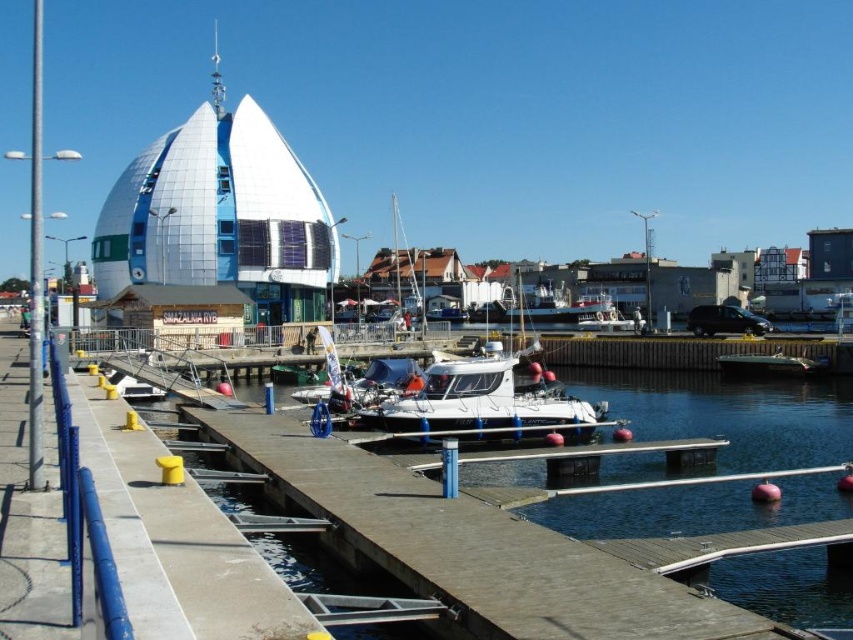
Question: Among these objects, which one is nearest to the camera?

Choices:
 (A) white glossy boat at lower right
 (B) white glossy boat at center
 (C) white matte boat at center

Answer: (C)

Question: Based on their relative distances, which object is nearer to the white glossy boat at lower right?

Choices:
 (A) white glossy boat at center
 (B) white matte boat at center

Answer: (A)

Question: Observing the image, what is the correct spatial positioning of white matte boat at center in reference to white glossy boat at center?

Choices:
 (A) below
 (B) above

Answer: (A)

Question: In this image, where is white matte boat at center located relative to white glossy boat at center?

Choices:
 (A) below
 (B) above

Answer: (A)

Question: Which object is farther from the camera taking this photo?

Choices:
 (A) white glossy boat at center
 (B) white glossy boat at lower right

Answer: (A)

Question: Is the position of white matte boat at center less distant than that of white glossy boat at lower right?

Choices:
 (A) yes
 (B) no

Answer: (A)